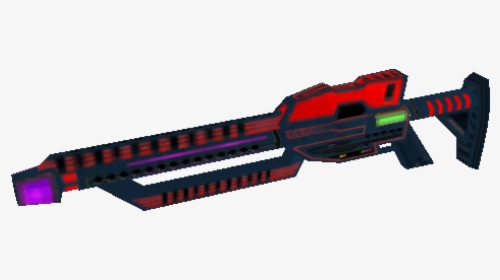
Where is `purple light`? Image resolution: width=500 pixels, height=280 pixels. purple light is located at coordinates (41, 196).